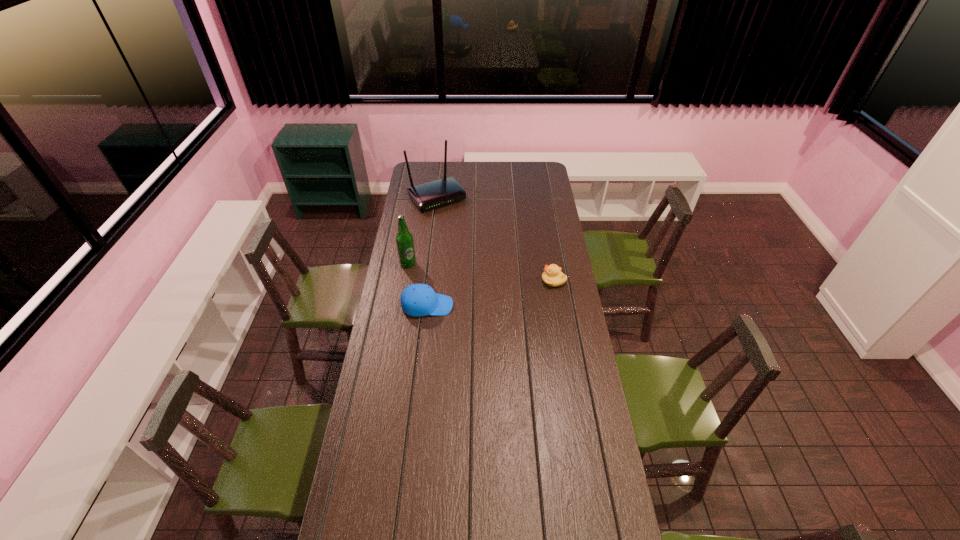
The width and height of the screenshot is (960, 540). Find the location of `empty space between the nearest object and the third farthest object`. empty space between the nearest object and the third farthest object is located at coordinates (491, 293).

Identify which object is the second closest to the router. Please provide its 2D coordinates. Your answer should be formatted as a tuple, i.e. [(x, y)], where the tuple contains the x and y coordinates of a point satisfying the conditions above.

[(552, 276)]

Choose which object is the third nearest neighbor to the cap. Please provide its 2D coordinates. Your answer should be formatted as a tuple, i.e. [(x, y)], where the tuple contains the x and y coordinates of a point satisfying the conditions above.

[(434, 194)]

You are a GUI agent. You are given a task and a screenshot of the screen. Output one action in this format:
    pyautogui.click(x=<x>, y=<y>)
    Task: Click on the free location that satisfies the following two spatial constraints: 1. on the front side of the beer bottle; 2. on the front-facing side of the cap
    
    Given the screenshot: What is the action you would take?
    pyautogui.click(x=401, y=306)

Where is `vacant space that satisfies the following two spatial constraints: 1. on the front side of the nearest object; 2. on the front-facing side of the beer bottle`? The height and width of the screenshot is (540, 960). vacant space that satisfies the following two spatial constraints: 1. on the front side of the nearest object; 2. on the front-facing side of the beer bottle is located at coordinates (401, 306).

Identify the location of free space that satisfies the following two spatial constraints: 1. on the front side of the farthest object; 2. on the front-facing side of the nearest object. (424, 306).

You are a GUI agent. You are given a task and a screenshot of the screen. Output one action in this format:
    pyautogui.click(x=<x>, y=<y>)
    Task: Click on the free space that satisfies the following two spatial constraints: 1. on the front side of the second farthest object; 2. on the front-facing side of the cap
    
    Given the screenshot: What is the action you would take?
    click(401, 306)